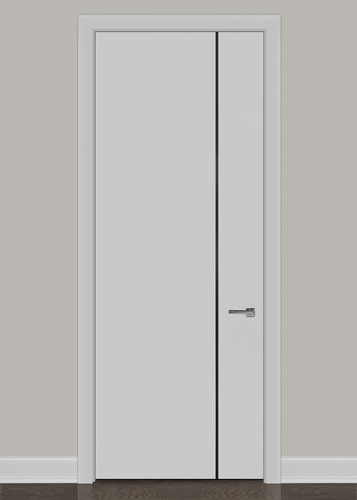
Locate an element on the screen. The width and height of the screenshot is (357, 500). black line in door is located at coordinates (217, 77).